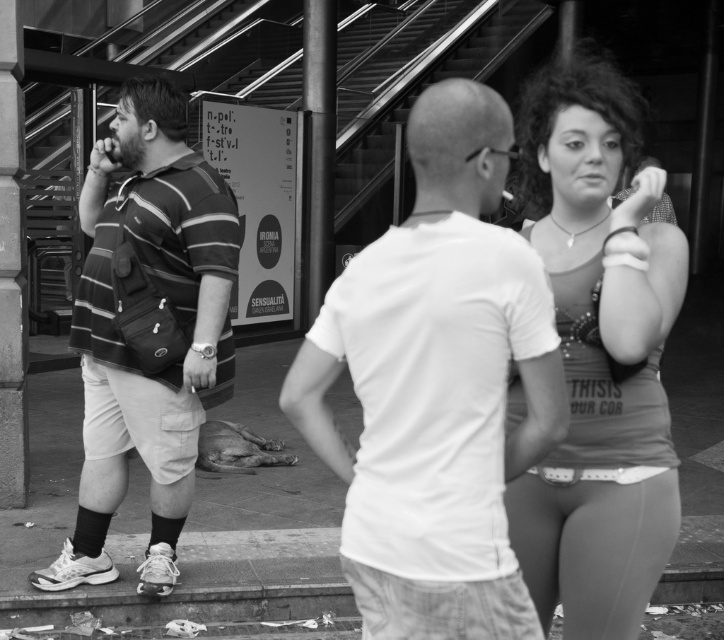
Question: Among these points, which one is farthest from the camera?

Choices:
 (A) (168, 516)
 (B) (644, 340)

Answer: (A)

Question: Which point is farther to the camera?

Choices:
 (A) matte gray tank top at right
 (B) white cotton t-shirt at center

Answer: (A)

Question: Is matte gray tank top at right smaller than striped fabric shirt at left?

Choices:
 (A) no
 (B) yes

Answer: (B)

Question: Estimate the real-world distances between objects in this image. Which object is farther from the white cotton t-shirt at center?

Choices:
 (A) matte gray tank top at right
 (B) striped fabric shirt at left

Answer: (B)

Question: Is white cotton t-shirt at center bigger than striped fabric shirt at left?

Choices:
 (A) yes
 (B) no

Answer: (B)

Question: Can you confirm if matte gray tank top at right is positioned to the left of striped fabric shirt at left?

Choices:
 (A) yes
 (B) no

Answer: (B)